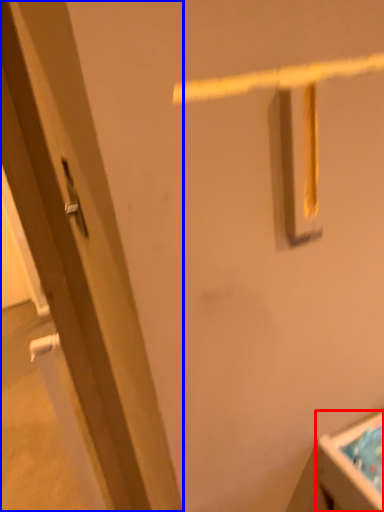
Question: Which of the following is the farthest to the observer, sink (highlighted by a red box) or door (highlighted by a blue box)?

Choices:
 (A) sink
 (B) door

Answer: (A)